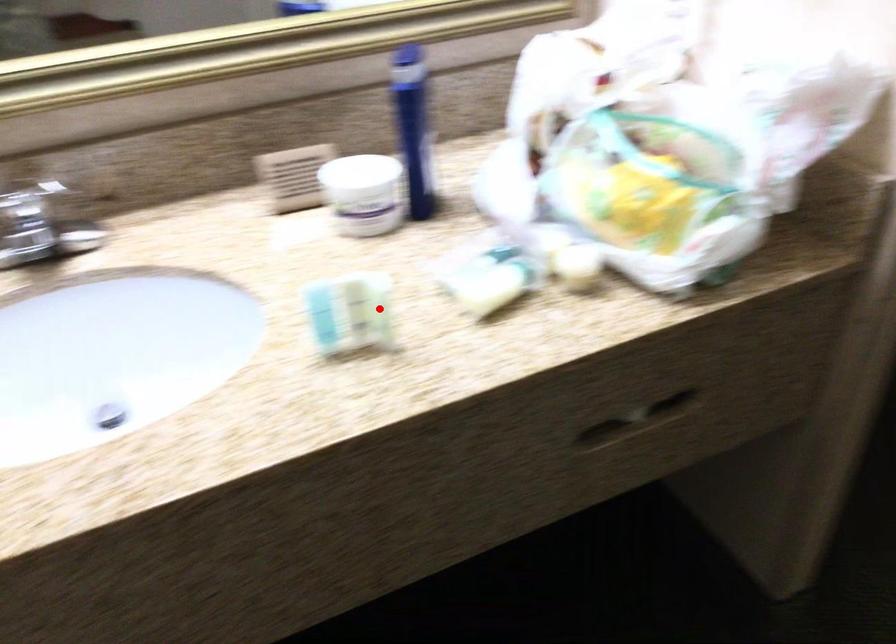
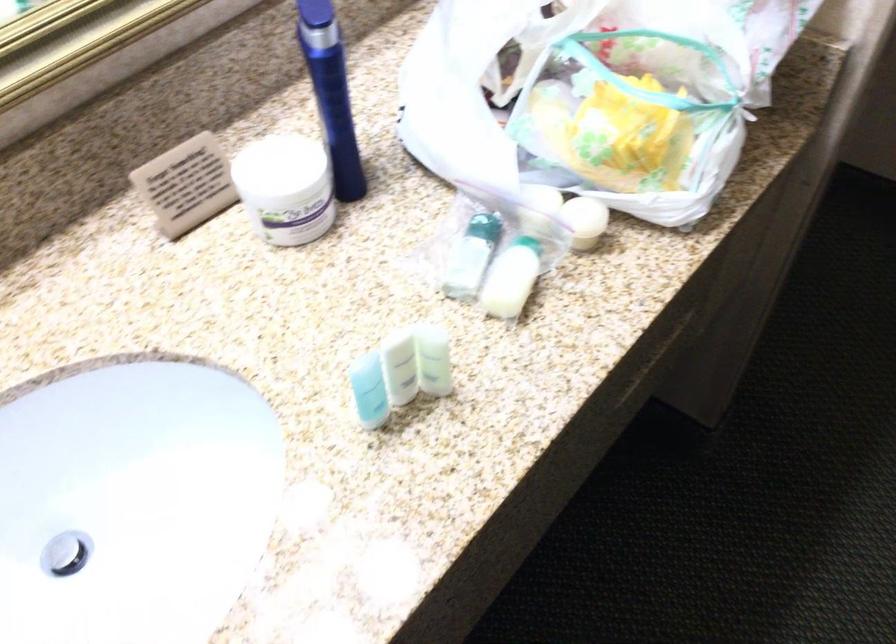
Question: I am providing you with two images of the same scene from different viewpoints. A red point is shown in image1. For the corresponding object point in image2, is it positioned nearer or farther from the camera?

Choices:
 (A) Nearer
 (B) Farther

Answer: (A)